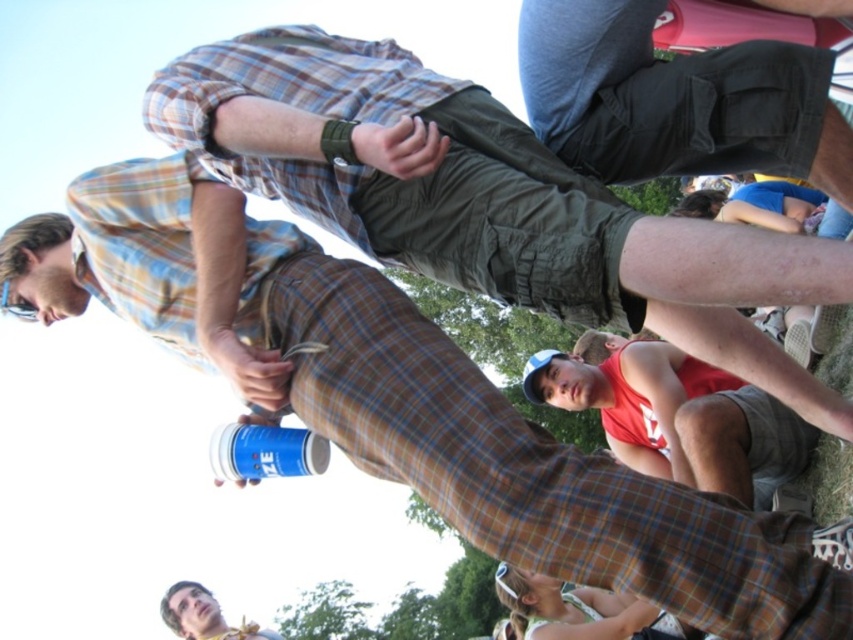
Is point (839, 177) positioned in front of point (194, 582)?

Yes, point (839, 177) is in front of point (194, 582).

In the scene shown: Which is more to the right, dark gray cargo shorts at center or smooth skin face at lower left?

dark gray cargo shorts at center is more to the right.

Locate an element on the screen. The height and width of the screenshot is (640, 853). dark gray cargo shorts at center is located at coordinates (676, 99).